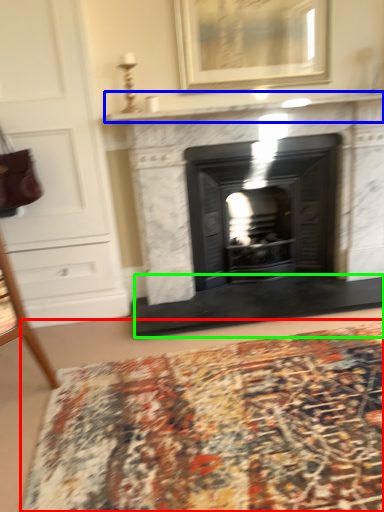
Question: Which is nearer to the mat (highlighted by a red box)? mantle (highlighted by a blue box) or doormat (highlighted by a green box).

Choices:
 (A) mantle
 (B) doormat

Answer: (B)